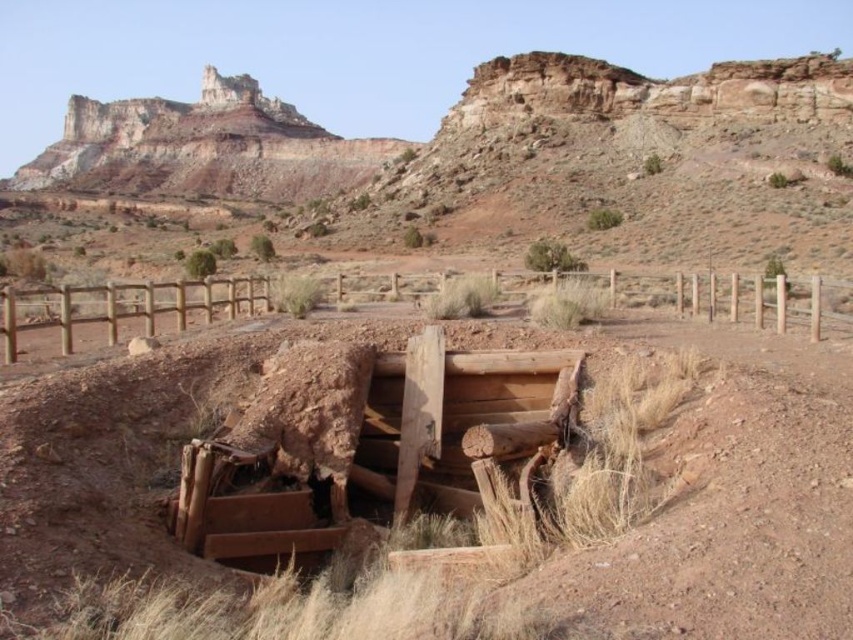
Question: Which point is farther from the camera taking this photo?

Choices:
 (A) (848, 316)
 (B) (669, 340)

Answer: (B)

Question: Is the position of brown rough wood at center more distant than that of brown wooden fence at center?

Choices:
 (A) yes
 (B) no

Answer: (B)

Question: Among these objects, which one is farthest from the camera?

Choices:
 (A) brown rough wood at center
 (B) brown wooden fence at center

Answer: (B)

Question: Is brown rough wood at center to the left of brown wooden fence at center from the viewer's perspective?

Choices:
 (A) no
 (B) yes

Answer: (A)

Question: Can you confirm if brown rough wood at center is wider than brown wooden fence at center?

Choices:
 (A) yes
 (B) no

Answer: (B)

Question: Which of the following is the farthest from the observer?

Choices:
 (A) pos(259,276)
 (B) pos(833,353)

Answer: (A)